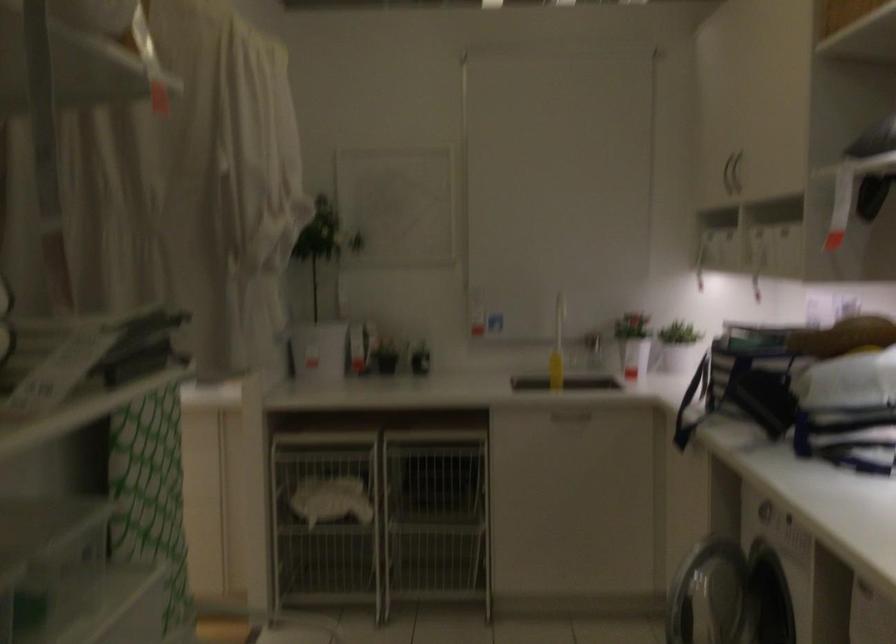
The height and width of the screenshot is (644, 896). What do you see at coordinates (693, 412) in the screenshot? I see `the bag handle` at bounding box center [693, 412].